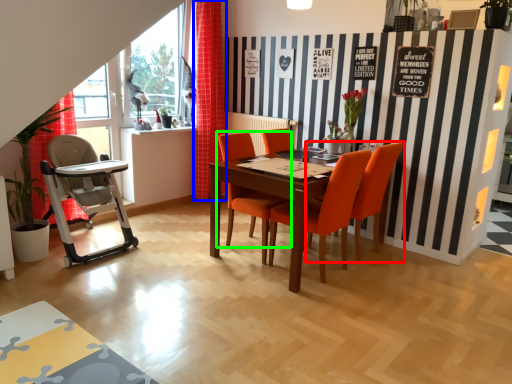
Question: Which object is positioned farthest from chair (highlighted by a red box)? Select from curtain (highlighted by a blue box) and chair (highlighted by a green box).

Choices:
 (A) curtain
 (B) chair

Answer: (A)